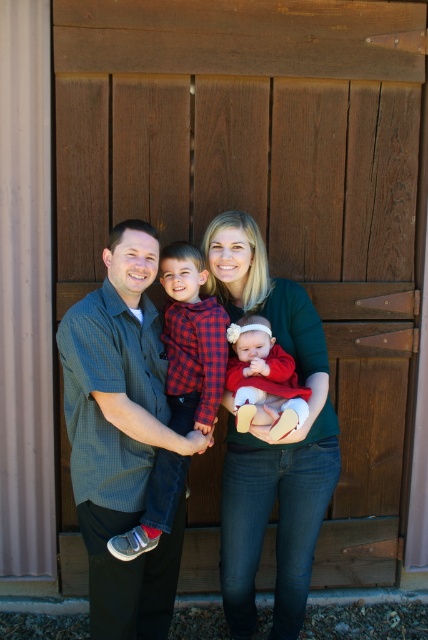
Is green checkered shirt at center shorter than matte green sweater at center?

Yes, green checkered shirt at center is shorter than matte green sweater at center.

Measure the distance between green checkered shirt at center and matte green sweater at center.

They are 13.08 inches apart.

What do you see at coordinates (121, 435) in the screenshot? I see `green checkered shirt at center` at bounding box center [121, 435].

The width and height of the screenshot is (428, 640). Identify the location of green checkered shirt at center. (121, 435).

Which is more to the right, green checkered shirt at center or matte red dress at center?

Positioned to the right is matte red dress at center.

Between green checkered shirt at center and matte red dress at center, which one has more height?

Standing taller between the two is green checkered shirt at center.

Between point (100, 298) and point (226, 332), which one is positioned in front?

Point (100, 298)

At what (x,y) coordinates should I click in order to perform the action: click on green checkered shirt at center. Please return your answer as a coordinate pair (x, y). This screenshot has height=640, width=428. Looking at the image, I should click on (121, 435).

Does matte green sweater at center have a greater width compared to red plaid shirt at center?

Yes, matte green sweater at center is wider than red plaid shirt at center.

Where is `matte green sweater at center`? This screenshot has height=640, width=428. matte green sweater at center is located at coordinates (270, 438).

Between point (306, 340) and point (187, 250), which one is positioned in front?

Positioned in front is point (187, 250).

This screenshot has height=640, width=428. I want to click on matte green sweater at center, so click(x=270, y=438).